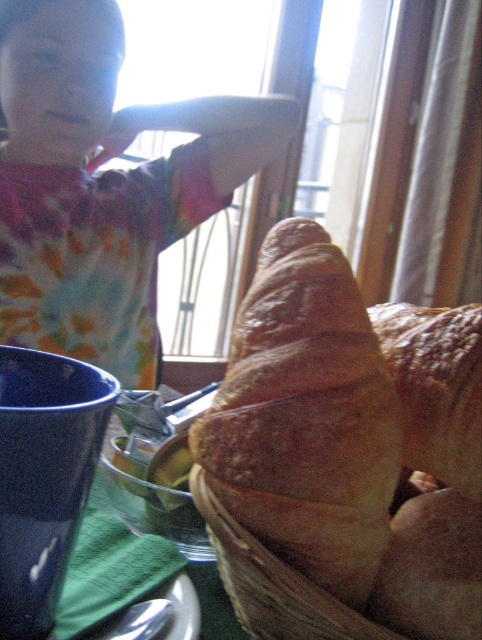
Question: Considering the relative positions of golden brown flaky croissant at center and golden brown flaky croissant at lower right in the image provided, where is golden brown flaky croissant at center located with respect to golden brown flaky croissant at lower right?

Choices:
 (A) left
 (B) right

Answer: (A)

Question: From the image, what is the correct spatial relationship of tie-dye fabric shirt at upper left in relation to golden brown flaky croissant at lower right?

Choices:
 (A) above
 (B) below

Answer: (A)

Question: Estimate the real-world distances between objects in this image. Which object is closer to the golden brown flaky croissant at lower right?

Choices:
 (A) tie-dye fabric shirt at upper left
 (B) golden brown flaky croissant at center

Answer: (B)

Question: Is golden brown flaky croissant at center positioned in front of golden brown flaky croissant at lower right?

Choices:
 (A) no
 (B) yes

Answer: (B)

Question: Which object is the farthest from the tie-dye fabric shirt at upper left?

Choices:
 (A) golden brown flaky croissant at lower right
 (B) golden brown flaky croissant at center

Answer: (B)

Question: Which of these objects is positioned closest to the golden brown flaky croissant at center?

Choices:
 (A) tie-dye fabric shirt at upper left
 (B) golden brown flaky croissant at lower right

Answer: (B)